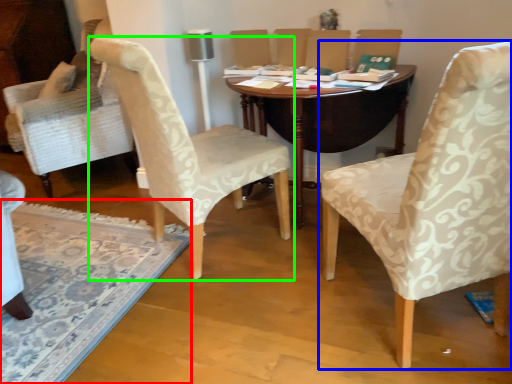
Question: Which is nearer to the mat (highlighted by a red box)? chair (highlighted by a blue box) or chair (highlighted by a green box).

Choices:
 (A) chair
 (B) chair

Answer: (B)